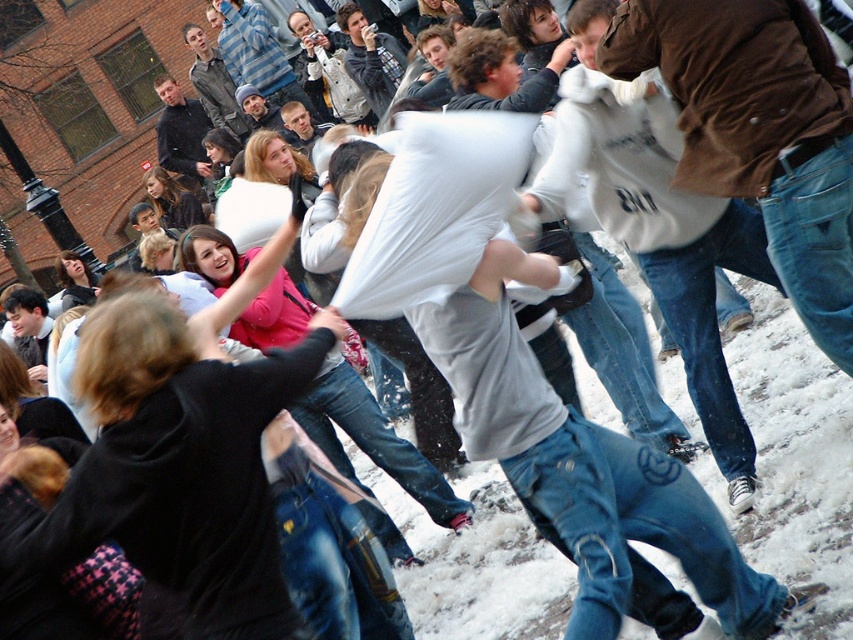
Question: Which object is positioned closest to the matte gray hoodie at center?

Choices:
 (A) striped sweater at center
 (B) white cotton pillow at center
 (C) matte black jacket at upper left
 (D) brown leather jacket at upper right

Answer: (A)

Question: Does white cotton pillow at center have a larger size compared to brushed metal jacket at upper center?

Choices:
 (A) yes
 (B) no

Answer: (B)

Question: Which object is farther from the camera taking this photo?

Choices:
 (A) striped sweater at center
 (B) brushed metal jacket at upper center
 (C) brown leather jacket at upper right
 (D) white cotton pillow at center

Answer: (B)

Question: In this image, where is white cotton pillow at center located relative to matte black jacket at upper left?

Choices:
 (A) left
 (B) right

Answer: (B)

Question: Which of these objects is positioned closest to the matte gray hoodie at center?

Choices:
 (A) brown leather jacket at upper right
 (B) brushed metal jacket at upper center
 (C) matte black jacket at upper left
 (D) white cotton pillow at center

Answer: (B)

Question: Is white cotton pillow at center positioned behind brown leather jacket at upper right?

Choices:
 (A) yes
 (B) no

Answer: (B)